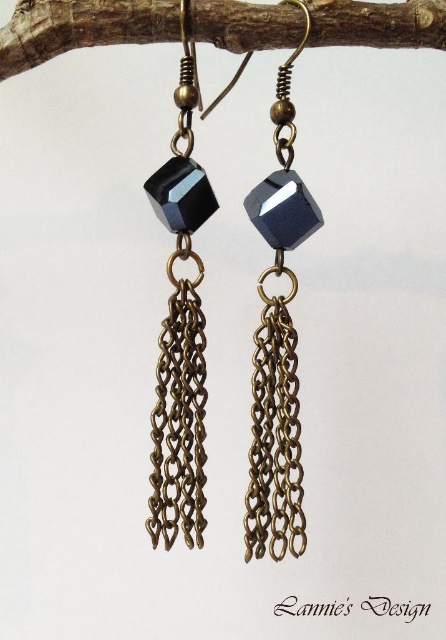
Question: Can you confirm if brown wood at upper center is positioned to the left of matte black cube at center?

Choices:
 (A) no
 (B) yes

Answer: (A)

Question: Which point is closer to the camera?

Choices:
 (A) brown wood at upper center
 (B) matte black cube at center
 (C) sapphire glass cube at center

Answer: (B)

Question: Which object is positioned farthest from the brown wood at upper center?

Choices:
 (A) sapphire glass cube at center
 (B) matte black cube at center

Answer: (A)

Question: Can you confirm if brown wood at upper center is wider than sapphire glass cube at center?

Choices:
 (A) yes
 (B) no

Answer: (A)

Question: Is brown wood at upper center bigger than sapphire glass cube at center?

Choices:
 (A) yes
 (B) no

Answer: (B)

Question: Among these points, which one is nearest to the camera?

Choices:
 (A) (28, 49)
 (B) (180, 500)
 (C) (286, 106)

Answer: (A)